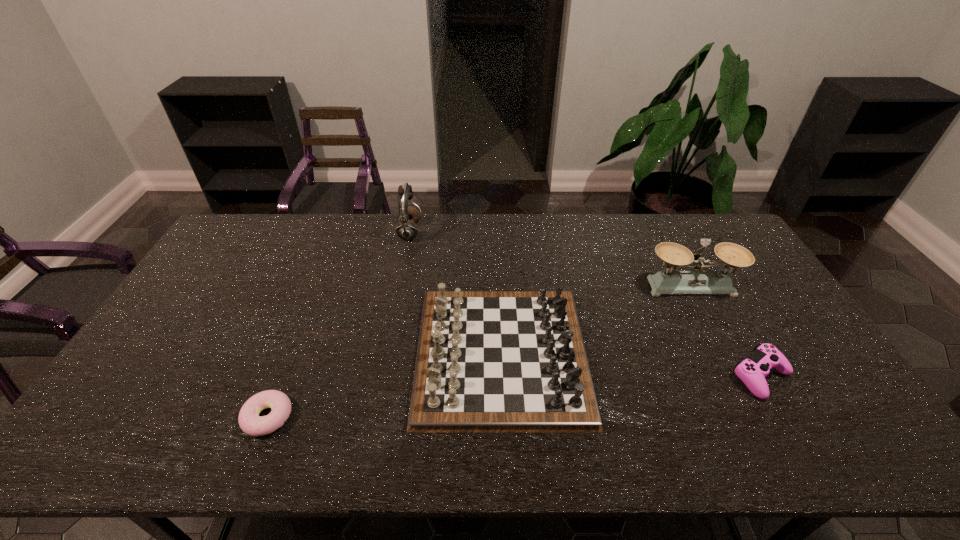
At what (x,y) coordinates should I click in order to perform the action: click on blank space at the far edge. Please return your answer as a coordinate pair (x, y). Looking at the image, I should click on (396, 225).

Where is `free region at the near edge`? free region at the near edge is located at coordinates (302, 448).

The width and height of the screenshot is (960, 540). I want to click on free space at the left edge, so click(184, 306).

Find the location of a particular element. This screenshot has width=960, height=540. vacant space at the right edge of the desktop is located at coordinates (756, 281).

Find the location of a particular element. The height and width of the screenshot is (540, 960). vacant area at the far right corner is located at coordinates (692, 236).

Identify the location of unoccupied area between the earphone and the leftmost object. This screenshot has height=540, width=960. (339, 325).

Where is `free space between the fourth object from right to left and the scale`? The width and height of the screenshot is (960, 540). free space between the fourth object from right to left and the scale is located at coordinates (550, 259).

The height and width of the screenshot is (540, 960). What are the coordinates of `free spot between the farthest object and the scale` in the screenshot? It's located at (550, 259).

Where is `empty location between the control and the fourth shortest object`? The width and height of the screenshot is (960, 540). empty location between the control and the fourth shortest object is located at coordinates (726, 331).

This screenshot has height=540, width=960. Identify the location of vacant space that's between the tallest object and the fourth shortest object. (550, 259).